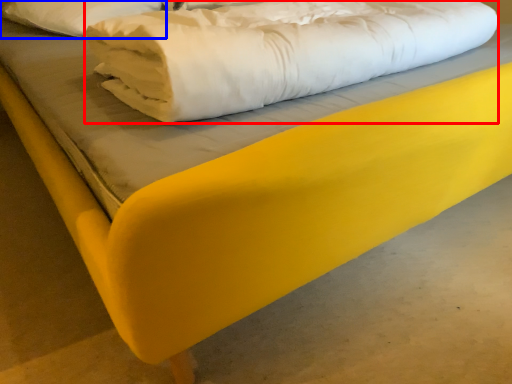
Question: Which object is further to the camera taking this photo, sheet (highlighted by a red box) or pillow (highlighted by a blue box)?

Choices:
 (A) sheet
 (B) pillow

Answer: (B)